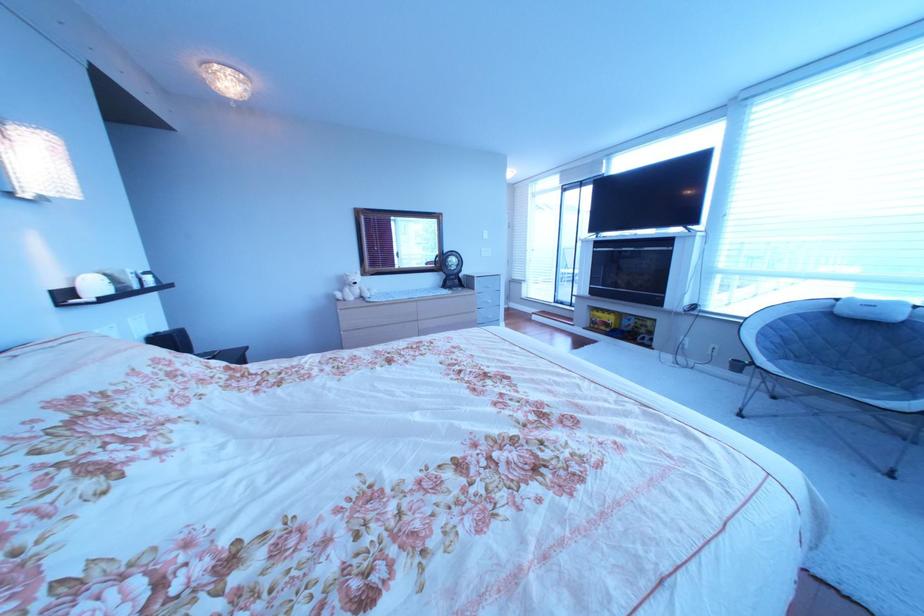
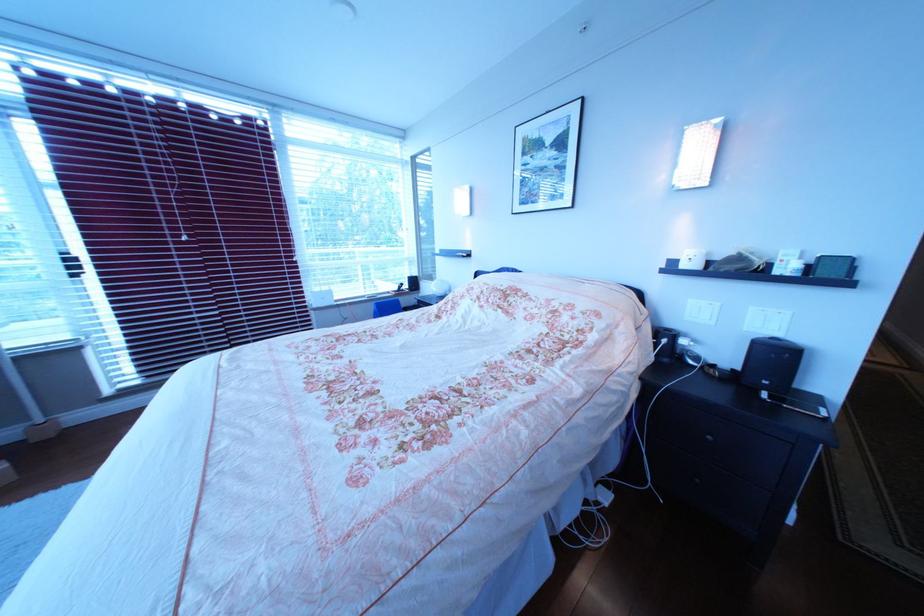
Locate, in the second image, the point that corresponds to point 103,294 in the first image.

(699, 267)